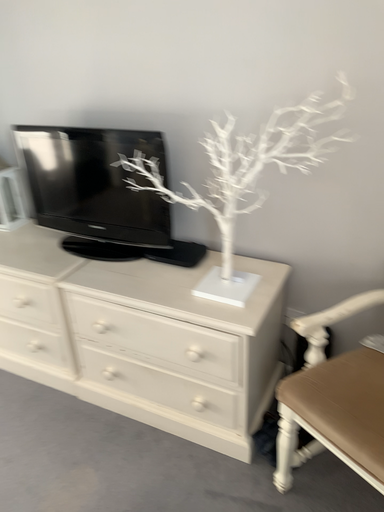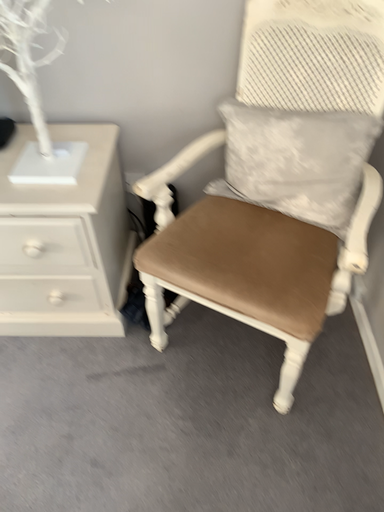
Question: Which way did the camera rotate in the video?

Choices:
 (A) rotated right
 (B) rotated left

Answer: (A)